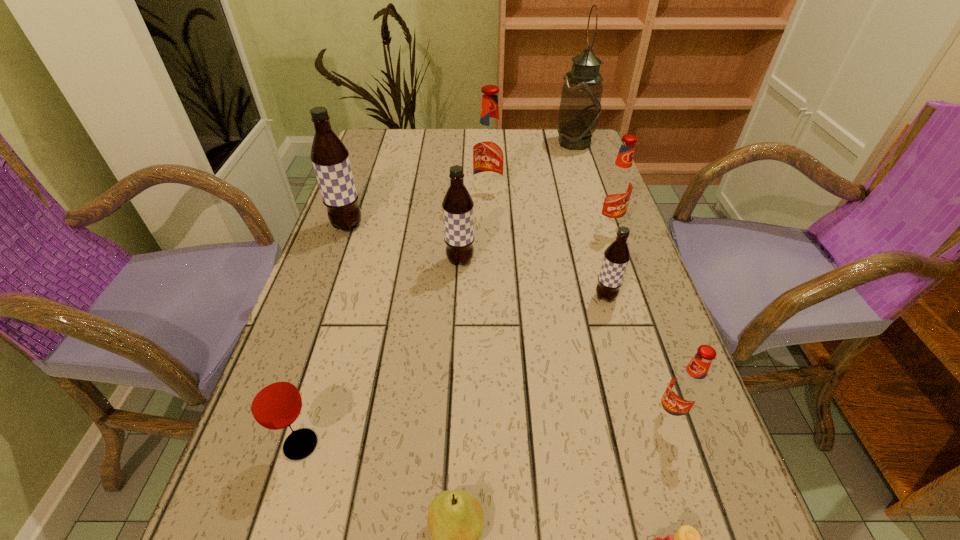
I want to click on blank space located 0.100m on the left of the nearest red root beer, so click(596, 416).

Find the location of `free space located on the back of the glass`. free space located on the back of the glass is located at coordinates (352, 274).

I want to click on object present at the far edge, so click(580, 106).

You are a GUI agent. You are given a task and a screenshot of the screen. Output one action in this format:
    pyautogui.click(x=<x>, y=<y>)
    Task: Click on the root beer that is at the left edge
    
    Given the screenshot: What is the action you would take?
    pyautogui.click(x=330, y=158)

The image size is (960, 540). In order to click on glass that is at the left edge in this screenshot , I will do `click(275, 402)`.

You are a GUI agent. You are given a task and a screenshot of the screen. Output one action in this format:
    pyautogui.click(x=<x>, y=<y>)
    Task: Click on the oil lamp that is at the right edge
    This screenshot has width=960, height=540.
    Given the screenshot: What is the action you would take?
    pyautogui.click(x=580, y=106)

At what (x,y) coordinates should I click in order to perform the action: click on object that is at the far right corner. Please return your answer as a coordinate pair (x, y). Looking at the image, I should click on (580, 106).

You are a GUI agent. You are given a task and a screenshot of the screen. Output one action in this format:
    pyautogui.click(x=<x>, y=<y>)
    Task: Click on the free spot at the left edge of the desktop
    The width and height of the screenshot is (960, 540).
    Given the screenshot: What is the action you would take?
    pyautogui.click(x=346, y=295)

Find the location of a particular element. vacant space at the right edge is located at coordinates (562, 167).

Find the location of `vacant space at the far left corner`. vacant space at the far left corner is located at coordinates (398, 144).